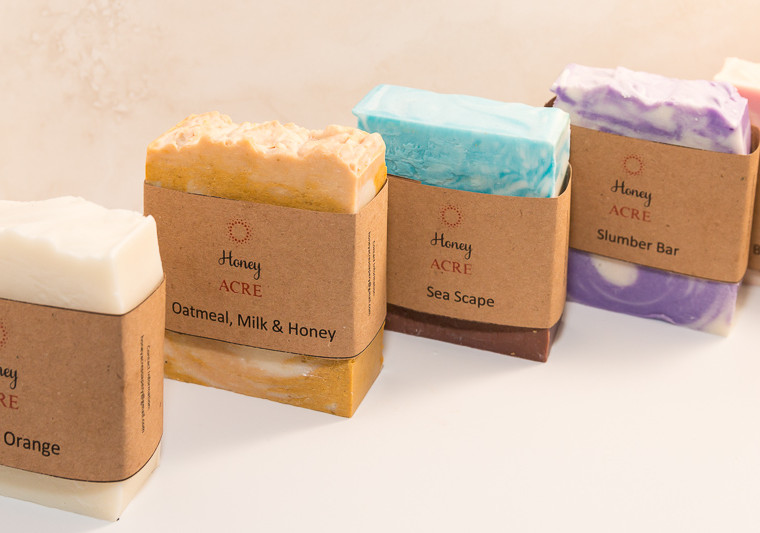
You are a GUI agent. You are given a task and a screenshot of the screen. Output one action in this format:
    pyautogui.click(x=<x>, y=<y>)
    Task: Click on the pink bar top
    This screenshot has width=760, height=533.
    Given the screenshot: What is the action you would take?
    pyautogui.click(x=754, y=85)